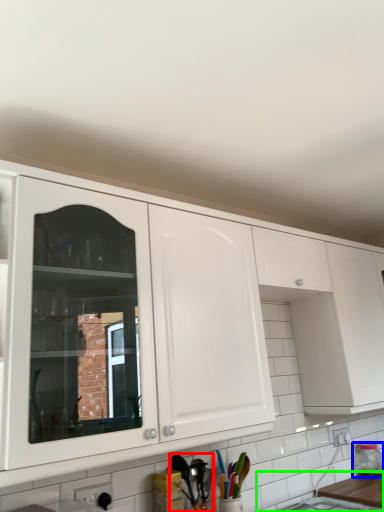
Question: Based on their relative distances, which object is farther from cutlery (highlighted by a red box)? Choose from bottle (highlighted by a blue box) and counter top (highlighted by a green box).

Choices:
 (A) bottle
 (B) counter top

Answer: (A)